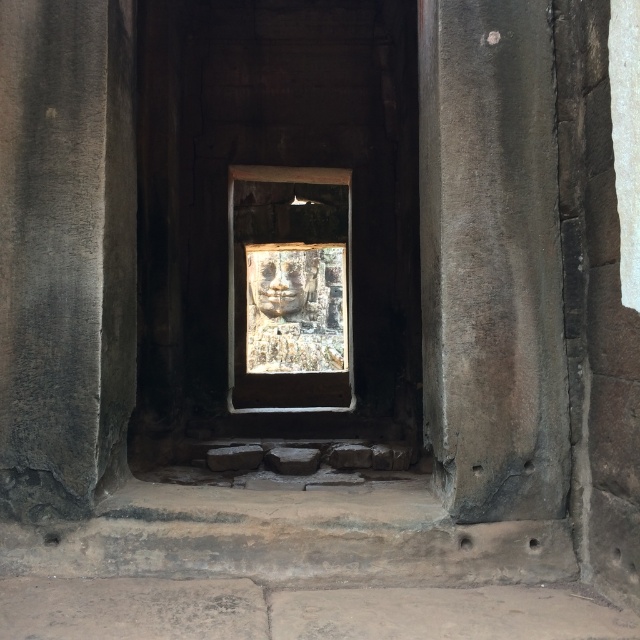
You are an archaeologist examining the corridor. You need to determine which object is taller between the gray stone pillar at center and the smooth stone face at center. Which one is taller?

The gray stone pillar at center has a greater height compared to the smooth stone face at center, so the gray stone pillar at center is taller.